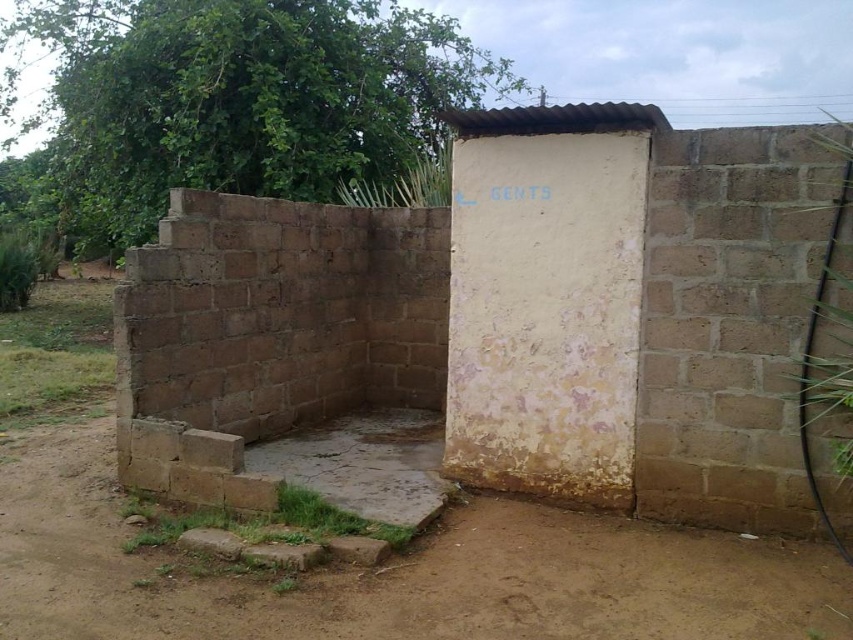
Question: Which object is closer to the camera taking this photo?

Choices:
 (A) brown dirt field at lower left
 (B) white painted brick toilet at center

Answer: (A)

Question: Does white painted brick toilet at center appear over brown dirt field at lower left?

Choices:
 (A) yes
 (B) no

Answer: (A)

Question: Which object is closer to the camera taking this photo?

Choices:
 (A) white painted brick toilet at center
 (B) brown dirt field at lower left

Answer: (B)

Question: Does white painted brick toilet at center have a smaller size compared to brown dirt field at lower left?

Choices:
 (A) no
 (B) yes

Answer: (A)

Question: Does white painted brick toilet at center come in front of brown dirt field at lower left?

Choices:
 (A) no
 (B) yes

Answer: (A)